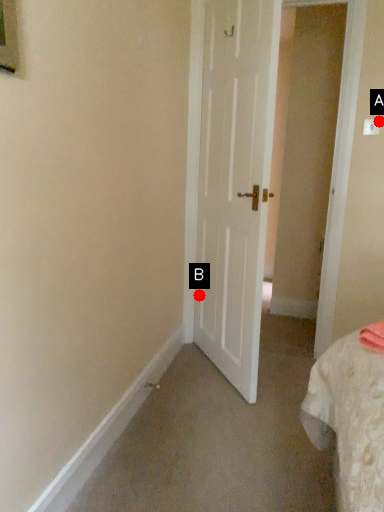
Question: Two points are circled on the image, labeled by A and B beside each circle. Which point is closer to the camera?

Choices:
 (A) A is closer
 (B) B is closer

Answer: (A)